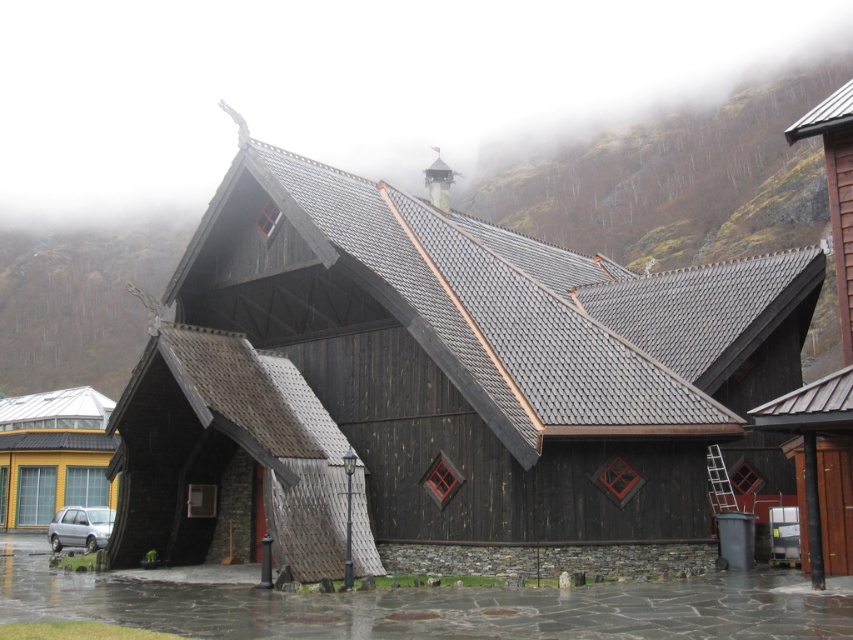
Question: Which object appears farthest from the camera in this image?

Choices:
 (A) silver metallic car at lower left
 (B) dark wood chapel at center

Answer: (A)

Question: Considering the relative positions of dark wood chapel at center and silver metallic car at lower left in the image provided, where is dark wood chapel at center located with respect to silver metallic car at lower left?

Choices:
 (A) right
 (B) left

Answer: (A)

Question: In this image, where is dark wood chapel at center located relative to silver metallic car at lower left?

Choices:
 (A) left
 (B) right

Answer: (B)

Question: Among these points, which one is farthest from the camera?

Choices:
 (A) (80, 534)
 (B) (437, 564)

Answer: (A)

Question: Does dark wood chapel at center lie in front of silver metallic car at lower left?

Choices:
 (A) no
 (B) yes

Answer: (B)